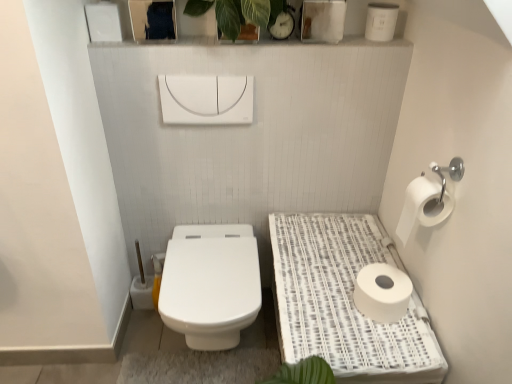
Locate an element on the screen. white woven tray at right is located at coordinates (345, 302).

Locate an element on the screen. white matte toilet paper at lower right, placed as the 2th toilet paper when sorted from top to bottom is located at coordinates (382, 292).

How much space does white matte toilet paper at lower right, acting as the first toilet paper starting from the bottom, occupy horizontally?

The width of white matte toilet paper at lower right, acting as the first toilet paper starting from the bottom, is 20.61 centimeters.

At what (x,y) coordinates should I click in order to perform the action: click on white glossy toilet at center. Please return your answer as a coordinate pair (x, y). The height and width of the screenshot is (384, 512). Looking at the image, I should click on (210, 284).

Where is `plant above the white matte toilet paper at right, marked as the first toilet paper in a top-to-bottom arrangement (from the image's perspective)`? This screenshot has height=384, width=512. plant above the white matte toilet paper at right, marked as the first toilet paper in a top-to-bottom arrangement (from the image's perspective) is located at coordinates (x=238, y=13).

From the image's perspective, is white matte toilet paper at right, which is the 2th toilet paper in bottom-to-top order, positioned above or below green leafy plant at upper center?

Based on their image positions, white matte toilet paper at right, which is the 2th toilet paper in bottom-to-top order, is located beneath green leafy plant at upper center.

Considering the relative sizes of white matte toilet paper at right, which is the 2th toilet paper in bottom-to-top order, and green leafy plant at upper center in the image provided, is white matte toilet paper at right, which is the 2th toilet paper in bottom-to-top order, shorter than green leafy plant at upper center?

No, white matte toilet paper at right, which is the 2th toilet paper in bottom-to-top order, is not shorter than green leafy plant at upper center.

Based on their sizes in the image, would you say white matte toilet paper at right, which is the 2th toilet paper in bottom-to-top order, is bigger or smaller than green leafy plant at upper center?

white matte toilet paper at right, which is the 2th toilet paper in bottom-to-top order, is smaller than green leafy plant at upper center.

Considering the sizes of objects green leafy plant at upper center and white woven tray at right in the image provided, who is smaller, green leafy plant at upper center or white woven tray at right?

With smaller size is green leafy plant at upper center.

What are the coordinates of `table below the green leafy plant at upper center (from a real-world perspective)` in the screenshot? It's located at (345, 302).

Would you say green leafy plant at upper center is to the left or to the right of white woven tray at right in the picture?

green leafy plant at upper center is positioned on white woven tray at right's left side.

From a real-world perspective, is green leafy plant at upper center located beneath white woven tray at right?

No, from a real-world perspective, green leafy plant at upper center is not beneath white woven tray at right.

In the scene shown: Does white woven tray at right have a greater height compared to white matte toilet paper at lower right, placed as the 2th toilet paper when sorted from top to bottom?

Indeed, white woven tray at right has a greater height compared to white matte toilet paper at lower right, placed as the 2th toilet paper when sorted from top to bottom.

Does white woven tray at right contain white matte toilet paper at lower right, acting as the first toilet paper starting from the bottom?

Absolutely, white matte toilet paper at lower right, acting as the first toilet paper starting from the bottom, is inside white woven tray at right.

Which is behind, white woven tray at right or white matte toilet paper at lower right, placed as the 2th toilet paper when sorted from top to bottom?

white matte toilet paper at lower right, placed as the 2th toilet paper when sorted from top to bottom, is further away from the camera.

Which is more distant, (327, 293) or (391, 316)?

The point (327, 293) is farther.

How different are the orientations of white matte toilet paper at lower right, acting as the first toilet paper starting from the bottom, and green leafy plant at upper center in degrees?

90.9 degrees.

Is white matte toilet paper at lower right, placed as the 2th toilet paper when sorted from top to bottom, not close to green leafy plant at upper center?

That's not correct — white matte toilet paper at lower right, placed as the 2th toilet paper when sorted from top to bottom, is a little close to green leafy plant at upper center.

Where is `plant above the white matte toilet paper at lower right, placed as the 2th toilet paper when sorted from top to bottom (from the image's perspective)`? This screenshot has height=384, width=512. plant above the white matte toilet paper at lower right, placed as the 2th toilet paper when sorted from top to bottom (from the image's perspective) is located at coordinates (238, 13).

Between white matte toilet paper at lower right, placed as the 2th toilet paper when sorted from top to bottom, and green leafy plant at upper center, which one is positioned behind?

white matte toilet paper at lower right, placed as the 2th toilet paper when sorted from top to bottom, is further away from the camera.

From the image's perspective, relative to white matte toilet paper at lower right, acting as the first toilet paper starting from the bottom, is white matte toilet paper at right, marked as the first toilet paper in a top-to-bottom arrangement, above or below?

Clearly, from the image's perspective, white matte toilet paper at right, marked as the first toilet paper in a top-to-bottom arrangement, is above white matte toilet paper at lower right, acting as the first toilet paper starting from the bottom.

Considering the relative positions of white matte toilet paper at right, marked as the first toilet paper in a top-to-bottom arrangement, and white matte toilet paper at lower right, acting as the first toilet paper starting from the bottom, in the image provided, is white matte toilet paper at right, marked as the first toilet paper in a top-to-bottom arrangement, to the right of white matte toilet paper at lower right, acting as the first toilet paper starting from the bottom, from the viewer's perspective?

Yes.

Which is in front, white matte toilet paper at right, marked as the first toilet paper in a top-to-bottom arrangement, or white matte toilet paper at lower right, placed as the 2th toilet paper when sorted from top to bottom?

Positioned in front is white matte toilet paper at right, marked as the first toilet paper in a top-to-bottom arrangement.

Is white matte toilet paper at right, which is the 2th toilet paper in bottom-to-top order, positioned far away from white matte toilet paper at lower right, acting as the first toilet paper starting from the bottom?

That's not correct — white matte toilet paper at right, which is the 2th toilet paper in bottom-to-top order, is a little close to white matte toilet paper at lower right, acting as the first toilet paper starting from the bottom.

How much distance is there between white matte toilet paper at right, which is the 2th toilet paper in bottom-to-top order, and white woven tray at right?

white matte toilet paper at right, which is the 2th toilet paper in bottom-to-top order, and white woven tray at right are 14.22 inches apart from each other.

From the image's perspective, is white matte toilet paper at right, which is the 2th toilet paper in bottom-to-top order, located above or below white woven tray at right?

Based on their image positions, white matte toilet paper at right, which is the 2th toilet paper in bottom-to-top order, is located above white woven tray at right.

At what (x,y) coordinates should I click in order to perform the action: click on the 2nd toilet paper above when counting from the white woven tray at right (from the image's perspective). Please return your answer as a coordinate pair (x, y). The height and width of the screenshot is (384, 512). Looking at the image, I should click on (423, 206).

Based on the photo, can you confirm if white matte toilet paper at right, marked as the first toilet paper in a top-to-bottom arrangement, is wider than white woven tray at right?

No, white matte toilet paper at right, marked as the first toilet paper in a top-to-bottom arrangement, is not wider than white woven tray at right.

Considering the positions of objects white glossy toilet at center and white woven tray at right in the image provided, who is more to the left, white glossy toilet at center or white woven tray at right?

Positioned to the left is white glossy toilet at center.

Considering the relative sizes of white glossy toilet at center and white woven tray at right in the image provided, is white glossy toilet at center bigger than white woven tray at right?

No.

Is white glossy toilet at center positioned far away from white woven tray at right?

white glossy toilet at center is near white woven tray at right, not far away.

Which is closer to the camera, (209,230) or (309,277)?

The point (309,277) is closer.

Locate an element on the screen. Image resolution: width=512 pixels, height=384 pixels. plant on the left of white matte toilet paper at right, which is the 2th toilet paper in bottom-to-top order is located at coordinates [x=238, y=13].

Image resolution: width=512 pixels, height=384 pixels. I want to click on table below the green leafy plant at upper center (from a real-world perspective), so click(345, 302).

Estimate the real-world distances between objects in this image. Which object is further from white glossy toilet at center, white woven tray at right or green leafy plant at upper center?

green leafy plant at upper center is positioned further to the anchor white glossy toilet at center.

Which object lies further to the anchor point white glossy toilet at center, white woven tray at right or white matte toilet paper at right, which is the 2th toilet paper in bottom-to-top order?

white matte toilet paper at right, which is the 2th toilet paper in bottom-to-top order, is further to white glossy toilet at center.

Considering their positions, is white glossy toilet at center positioned closer to white matte toilet paper at right, which is the 2th toilet paper in bottom-to-top order, than white matte toilet paper at lower right, acting as the first toilet paper starting from the bottom?

Among the two, white matte toilet paper at lower right, acting as the first toilet paper starting from the bottom, is located nearer to white matte toilet paper at right, which is the 2th toilet paper in bottom-to-top order.

Which object lies nearer to the anchor point white matte toilet paper at right, which is the 2th toilet paper in bottom-to-top order, white woven tray at right or white glossy toilet at center?

Among the two, white woven tray at right is located nearer to white matte toilet paper at right, which is the 2th toilet paper in bottom-to-top order.

Based on their spatial positions, is white glossy toilet at center or green leafy plant at upper center closer to white woven tray at right?

Among the two, white glossy toilet at center is located nearer to white woven tray at right.

When comparing their distances from white matte toilet paper at lower right, acting as the first toilet paper starting from the bottom, does white woven tray at right or white glossy toilet at center seem closer?

Based on the image, white woven tray at right appears to be nearer to white matte toilet paper at lower right, acting as the first toilet paper starting from the bottom.

Considering their positions, is white matte toilet paper at lower right, placed as the 2th toilet paper when sorted from top to bottom, positioned further to green leafy plant at upper center than white matte toilet paper at right, marked as the first toilet paper in a top-to-bottom arrangement?

white matte toilet paper at lower right, placed as the 2th toilet paper when sorted from top to bottom, is positioned further to the anchor green leafy plant at upper center.

From the image, which object appears to be farther from white matte toilet paper at lower right, acting as the first toilet paper starting from the bottom, white matte toilet paper at right, which is the 2th toilet paper in bottom-to-top order, or white woven tray at right?

white matte toilet paper at right, which is the 2th toilet paper in bottom-to-top order.

The height and width of the screenshot is (384, 512). In order to click on table between white glossy toilet at center and white matte toilet paper at right, marked as the first toilet paper in a top-to-bottom arrangement, from left to right in this screenshot , I will do `click(345, 302)`.

This screenshot has width=512, height=384. Identify the location of toilet between green leafy plant at upper center and white woven tray at right in the up-down direction. (210, 284).

Locate an element on the screen. Image resolution: width=512 pixels, height=384 pixels. toilet paper between green leafy plant at upper center and white matte toilet paper at lower right, placed as the 2th toilet paper when sorted from top to bottom, from top to bottom is located at coordinates (423, 206).

At what (x,y) coordinates should I click in order to perform the action: click on toilet paper between white matte toilet paper at right, which is the 2th toilet paper in bottom-to-top order, and white woven tray at right vertically. Please return your answer as a coordinate pair (x, y). Looking at the image, I should click on (382, 292).